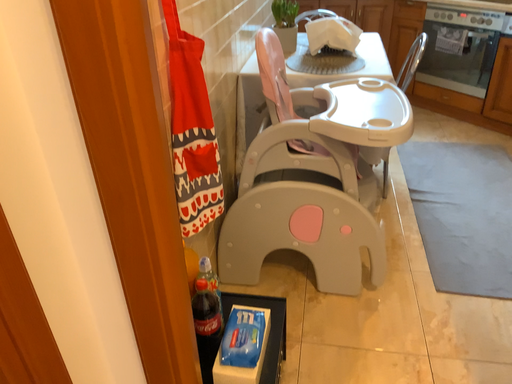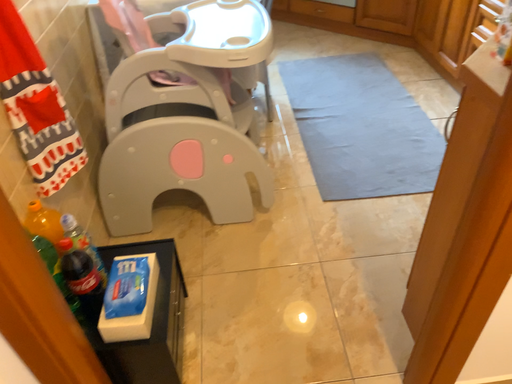
Question: Which way did the camera rotate in the video?

Choices:
 (A) rotated downward
 (B) rotated upward

Answer: (A)